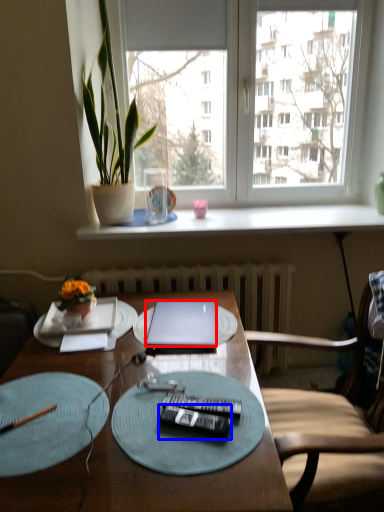
Question: Which object appears closest to the camera in this image, laptop (highlighted by a red box) or remote control (highlighted by a blue box)?

Choices:
 (A) laptop
 (B) remote control

Answer: (B)